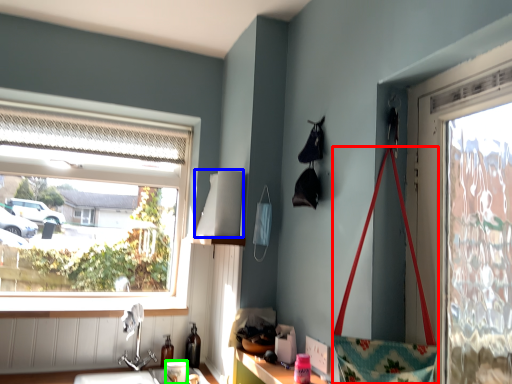
Question: Which object is the farthest from handbag (highlighted by a red box)? Choose among these: lampshade (highlighted by a blue box) or coffee cup (highlighted by a green box).

Choices:
 (A) lampshade
 (B) coffee cup

Answer: (B)